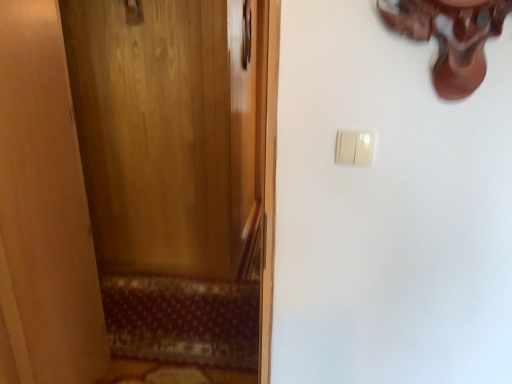
This screenshot has height=384, width=512. I want to click on wooden door at left, so tap(180, 180).

The image size is (512, 384). Identify the location of polished brass door handle at upper left. (133, 12).

Image resolution: width=512 pixels, height=384 pixels. I want to click on doormat that is behind the wooden door at left, so click(x=182, y=320).

From the image's perspective, between patterned carpet at lower left and wooden door at left, which one is located above?

wooden door at left.

Could you tell me if patterned carpet at lower left is facing wooden door at left?

No, patterned carpet at lower left is not turned towards wooden door at left.

Is patterned carpet at lower left far away from wooden door at left?

They are positioned close to each other.

Are patterned carpet at lower left and polished brass door handle at upper left located far from each other?

patterned carpet at lower left is far away from polished brass door handle at upper left.

Is polished brass door handle at upper left completely or partially inside patterned carpet at lower left?

No, polished brass door handle at upper left is located outside of patterned carpet at lower left.

Does patterned carpet at lower left have a greater height compared to polished brass door handle at upper left?

No.

From the image's perspective, between patterned carpet at lower left and polished brass door handle at upper left, who is located below?

From the image's view, patterned carpet at lower left is below.

How far apart are wooden door at left and patterned carpet at lower left?

wooden door at left is 15.90 inches from patterned carpet at lower left.

Is wooden door at left bigger than patterned carpet at lower left?

Yes.

Is wooden door at left not within patterned carpet at lower left?

Yes, wooden door at left is located beyond the bounds of patterned carpet at lower left.

Looking at this image, which object is more forward, white plastic light switch at upper right or patterned carpet at lower left?

white plastic light switch at upper right is more forward.

Is point (362, 142) farther from camera compared to point (144, 279)?

No.

From a real-world perspective, which object stands above the other?

white plastic light switch at upper right is physically above.

Does polished brass door handle at upper left contain patterned carpet at lower left?

Actually, patterned carpet at lower left is outside polished brass door handle at upper left.

From the image's perspective, is polished brass door handle at upper left on patterned carpet at lower left?

Yes.

Which of these two, polished brass door handle at upper left or patterned carpet at lower left, is bigger?

patterned carpet at lower left.

Locate an element on the screen. Image resolution: width=512 pixels, height=384 pixels. door handle on the left of patterned carpet at lower left is located at coordinates (133, 12).

Is white plastic light switch at upper right not close to polished brass door handle at upper left?

Absolutely, white plastic light switch at upper right is distant from polished brass door handle at upper left.

Is white plastic light switch at upper right at the right side of polished brass door handle at upper left?

Yes, white plastic light switch at upper right is to the right of polished brass door handle at upper left.

How far apart are white plastic light switch at upper right and polished brass door handle at upper left?

white plastic light switch at upper right is 6.38 feet from polished brass door handle at upper left.

Considering the relative sizes of white plastic light switch at upper right and polished brass door handle at upper left in the image provided, is white plastic light switch at upper right bigger than polished brass door handle at upper left?

Incorrect, white plastic light switch at upper right is not larger than polished brass door handle at upper left.

From a real-world perspective, does polished brass door handle at upper left sit lower than white plastic light switch at upper right?

Actually, polished brass door handle at upper left is physically above white plastic light switch at upper right in the real world.

Locate an element on the screen. The width and height of the screenshot is (512, 384). door handle behind the white plastic light switch at upper right is located at coordinates (133, 12).

Is polished brass door handle at upper left thinner than white plastic light switch at upper right?

No, polished brass door handle at upper left is not thinner than white plastic light switch at upper right.

Is polished brass door handle at upper left far away from white plastic light switch at upper right?

Yes, polished brass door handle at upper left is far from white plastic light switch at upper right.

The width and height of the screenshot is (512, 384). In order to click on door above the patterned carpet at lower left (from a real-world perspective) in this screenshot , I will do `click(180, 180)`.

Identify the location of doormat below the polished brass door handle at upper left (from a real-world perspective). (182, 320).

From the image, which object appears to be nearer to wooden door at left, polished brass door handle at upper left or white plastic light switch at upper right?

polished brass door handle at upper left.

Considering their positions, is wooden door at left positioned further to polished brass door handle at upper left than white plastic light switch at upper right?

white plastic light switch at upper right lies further to polished brass door handle at upper left than the other object.

Looking at the image, which one is located closer to white plastic light switch at upper right, patterned carpet at lower left or polished brass door handle at upper left?

The object closer to white plastic light switch at upper right is patterned carpet at lower left.

Considering their positions, is wooden door at left positioned further to patterned carpet at lower left than polished brass door handle at upper left?

The object further to patterned carpet at lower left is polished brass door handle at upper left.

Estimate the real-world distances between objects in this image. Which object is closer to white plastic light switch at upper right, polished brass door handle at upper left or wooden door at left?

polished brass door handle at upper left is closer to white plastic light switch at upper right.

Which object lies nearer to the anchor point wooden door at left, patterned carpet at lower left or white plastic light switch at upper right?

patterned carpet at lower left lies closer to wooden door at left than the other object.

From the image, which object appears to be farther from white plastic light switch at upper right, patterned carpet at lower left or wooden door at left?

Among the two, wooden door at left is located further to white plastic light switch at upper right.

Which object lies further to the anchor point white plastic light switch at upper right, wooden door at left or polished brass door handle at upper left?

wooden door at left is further to white plastic light switch at upper right.

The width and height of the screenshot is (512, 384). What are the coordinates of `light switch between polished brass door handle at upper left and patterned carpet at lower left in the up-down direction` in the screenshot? It's located at (354, 148).

Identify the location of door between polished brass door handle at upper left and patterned carpet at lower left in the vertical direction. (180, 180).

The image size is (512, 384). I want to click on light switch positioned between wooden door at left and polished brass door handle at upper left from near to far, so click(x=354, y=148).

Find the location of a particular element. Image resolution: width=512 pixels, height=384 pixels. light switch positioned between wooden door at left and patterned carpet at lower left from near to far is located at coordinates (354, 148).